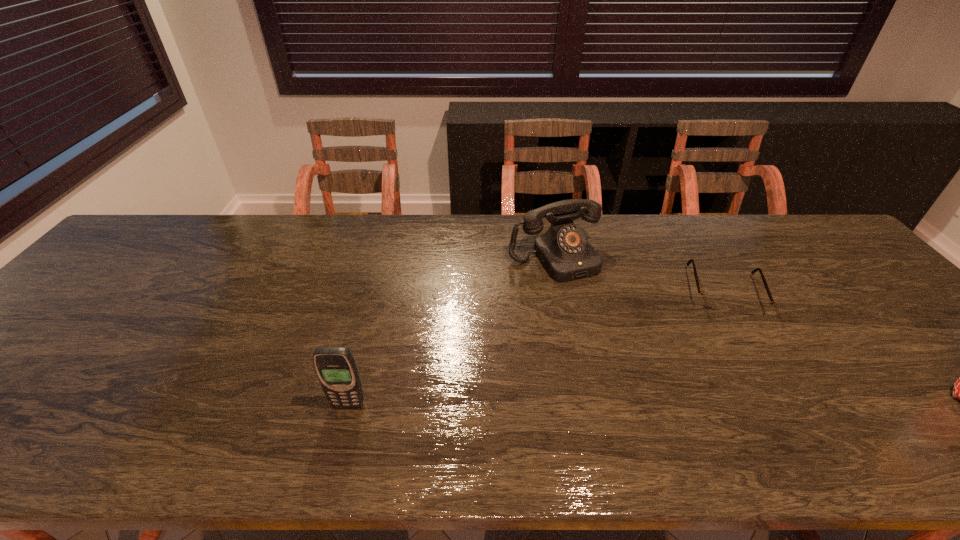
In order to click on vacant region located on the dial of the second object from right to left in this screenshot , I will do `click(651, 392)`.

Where is `object at the far edge`? The width and height of the screenshot is (960, 540). object at the far edge is located at coordinates (564, 251).

At what (x,y) coordinates should I click in order to perform the action: click on object at the near edge. Please return your answer as a coordinate pair (x, y). The width and height of the screenshot is (960, 540). Looking at the image, I should click on (336, 368).

In the image, there is a desktop. At what (x,y) coordinates should I click in order to perform the action: click on vacant space at the far edge. Please return your answer as a coordinate pair (x, y). The width and height of the screenshot is (960, 540). Looking at the image, I should click on (426, 238).

You are a GUI agent. You are given a task and a screenshot of the screen. Output one action in this format:
    pyautogui.click(x=<x>, y=<y>)
    Task: Click on the free region at the near edge of the desktop
    The image size is (960, 540).
    Given the screenshot: What is the action you would take?
    pyautogui.click(x=613, y=384)

You are a GUI agent. You are given a task and a screenshot of the screen. Output one action in this format:
    pyautogui.click(x=<x>, y=<y>)
    Task: Click on the vacant space at the left edge
    
    Given the screenshot: What is the action you would take?
    pyautogui.click(x=111, y=285)

Locate an element on the screen. Image resolution: width=960 pixels, height=540 pixels. free space at the right edge of the desktop is located at coordinates (905, 309).

Locate an element on the screen. vacant space at the far left corner of the desktop is located at coordinates (159, 232).

You are a GUI agent. You are given a task and a screenshot of the screen. Output one action in this format:
    pyautogui.click(x=<x>, y=<y>)
    Task: Click on the vacant point located between the nearest object and the second object from right to left
    The height and width of the screenshot is (540, 960).
    Given the screenshot: What is the action you would take?
    pyautogui.click(x=451, y=332)

Where is `vacant point located between the nearest object and the second object from left to right`? The height and width of the screenshot is (540, 960). vacant point located between the nearest object and the second object from left to right is located at coordinates (451, 332).